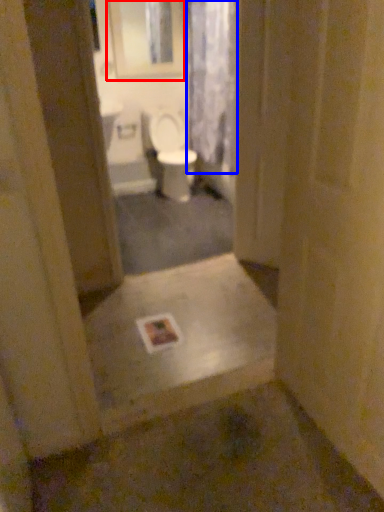
Question: Which object is closer to the camera taking this photo, medicine cabinet (highlighted by a red box) or shower curtain (highlighted by a blue box)?

Choices:
 (A) medicine cabinet
 (B) shower curtain

Answer: (B)